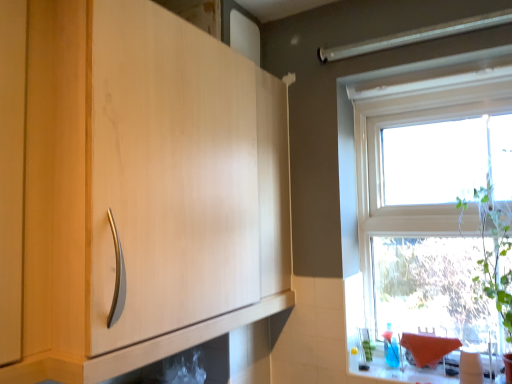
Question: Relative to transparent glass window at upper right, is matte wood cabinet at center in front or behind?

Choices:
 (A) front
 (B) behind

Answer: (A)

Question: From a real-world perspective, is matte wood cabinet at center positioned above or below transparent glass window at upper right?

Choices:
 (A) above
 (B) below

Answer: (A)

Question: Estimate the real-world distances between objects in this image. Which object is farther from the transparent glass window at upper right?

Choices:
 (A) matte wood cabinet at center
 (B) white glossy counter top at lower right

Answer: (A)

Question: Based on their relative distances, which object is farther from the white glossy counter top at lower right?

Choices:
 (A) matte wood cabinet at center
 (B) transparent glass window at upper right

Answer: (A)